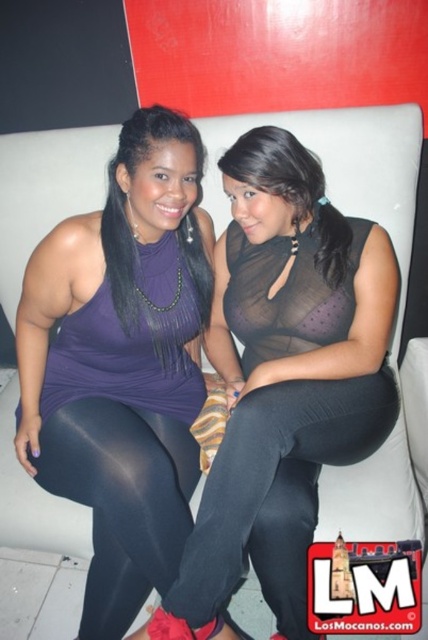
Question: Considering the real-world distances, which object is closest to the purple matte tank top at center?

Choices:
 (A) black spandex leggings at center
 (B) matte purple tank top at center
 (C) matte purple top at center

Answer: (A)

Question: Is black spandex leggings at center above matte purple top at center?

Choices:
 (A) no
 (B) yes

Answer: (A)

Question: Which object is farther from the camera taking this photo?

Choices:
 (A) matte purple tank top at center
 (B) purple matte tank top at center
 (C) matte purple top at center

Answer: (C)

Question: Can you confirm if black spandex leggings at center is wider than matte black leggings at lower left?

Choices:
 (A) yes
 (B) no

Answer: (A)

Question: Can you confirm if black spandex leggings at center is positioned to the right of matte black leggings at lower left?

Choices:
 (A) yes
 (B) no

Answer: (A)

Question: Which object is farther from the camera taking this photo?

Choices:
 (A) matte purple top at center
 (B) black spandex leggings at center
 (C) matte purple tank top at center

Answer: (A)